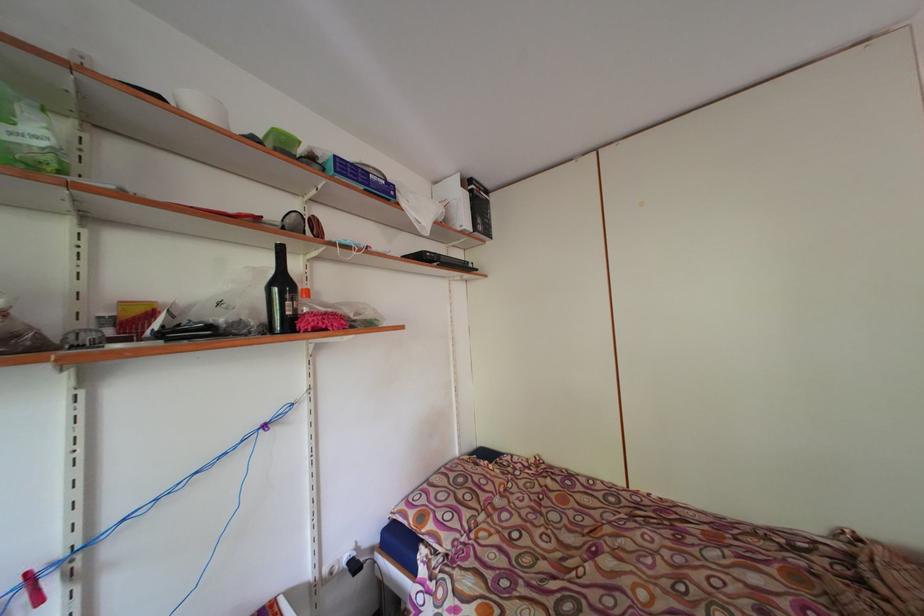
Identify the location of dark glass bottle. (281, 296).